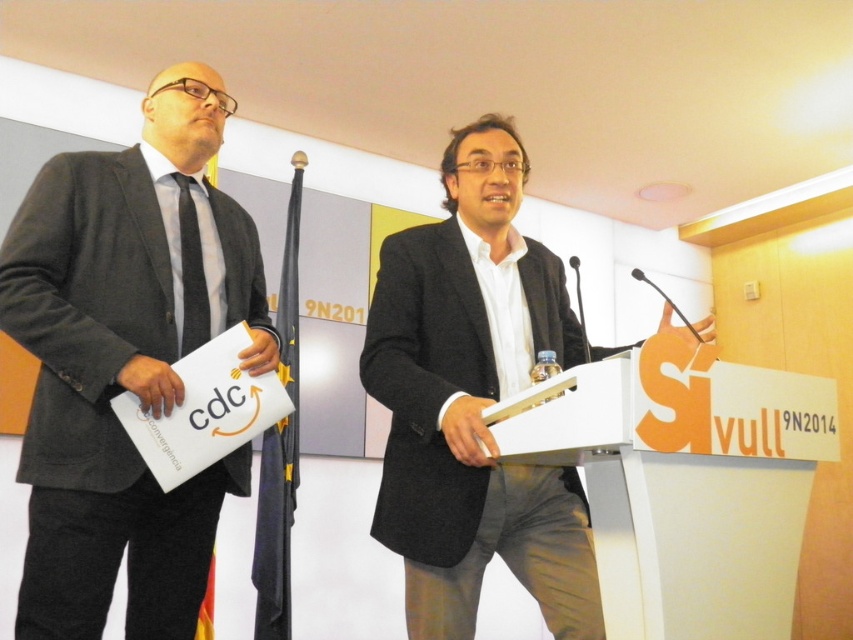
Does point (85, 625) come in front of point (189, 224)?

Yes.

Is matte black suit at left to the left of black striped tie at left from the viewer's perspective?

Indeed, matte black suit at left is positioned on the left side of black striped tie at left.

The image size is (853, 640). What do you see at coordinates (123, 364) in the screenshot?
I see `matte black suit at left` at bounding box center [123, 364].

Find the location of a particular element. This screenshot has width=853, height=640. matte black suit at left is located at coordinates (123, 364).

Between dark gray wool coat at center and white plastic podium at center, which one is positioned lower?

white plastic podium at center is lower down.

Does point (474, 323) come farther from viewer compared to point (547, 433)?

Yes.

Where is `dark gray wool coat at center`? dark gray wool coat at center is located at coordinates (474, 401).

Is white plastic podium at center positioned behind black striped tie at left?

No, white plastic podium at center is in front of black striped tie at left.

Can you confirm if white plastic podium at center is wider than black striped tie at left?

Yes.

The image size is (853, 640). Identify the location of white plastic podium at center. (x=683, y=483).